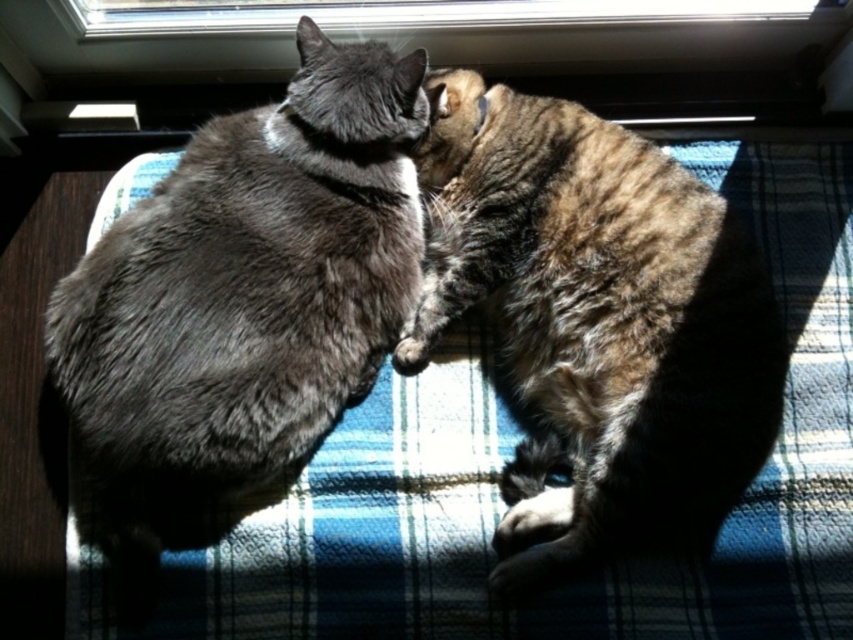
Does gray fur cat at center lie behind transparent glass window at upper center?

No, it is in front of transparent glass window at upper center.

Which is in front, point (138, 480) or point (289, 22)?

Point (138, 480)

Image resolution: width=853 pixels, height=640 pixels. Describe the element at coordinates (244, 292) in the screenshot. I see `gray fur cat at center` at that location.

What are the coordinates of `gray fur cat at center` in the screenshot? It's located at (244, 292).

Does point (328, 179) come behind point (424, 154)?

No, (328, 179) is closer to viewer.

I want to click on gray fur cat at center, so click(244, 292).

Identify the location of gray fur cat at center. This screenshot has width=853, height=640. (244, 292).

Who is more distant from viewer, (479, 278) or (260, 3)?

The point (260, 3) is behind.

Who is taller, tabby fur cat at center or transparent glass window at upper center?

Standing taller between the two is tabby fur cat at center.

Who is more distant from viewer, (439, 160) or (277, 17)?

Point (277, 17)

You are a GUI agent. You are given a task and a screenshot of the screen. Output one action in this format:
    pyautogui.click(x=<x>, y=<y>)
    Task: Click on the tabby fur cat at center
    The image size is (853, 640).
    Given the screenshot: What is the action you would take?
    pyautogui.click(x=592, y=310)